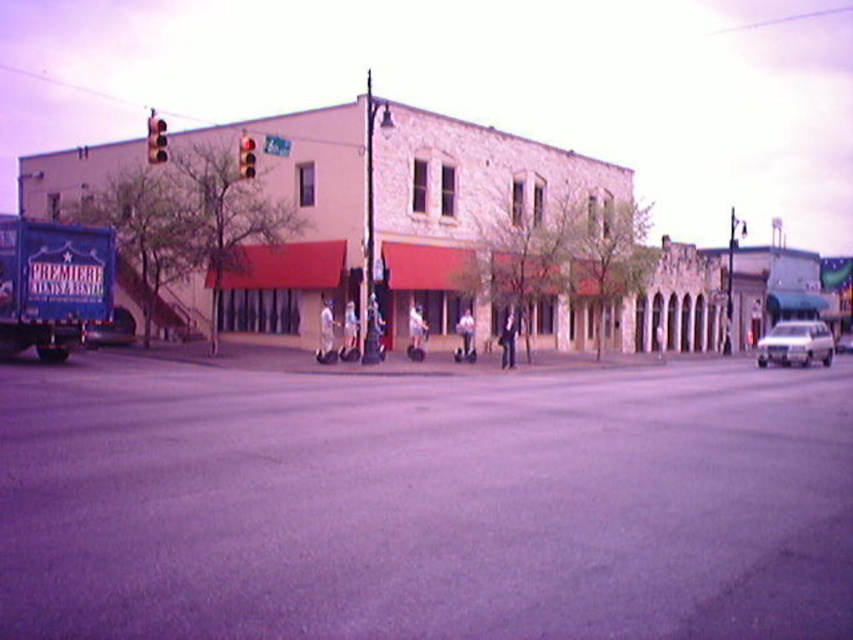
Question: Can you confirm if dark asphalt road at center is positioned above metallic traffic light at upper left?

Choices:
 (A) no
 (B) yes

Answer: (A)

Question: Which object is positioned closest to the silver metallic sedan at right?

Choices:
 (A) red glass traffic light at upper center
 (B) metallic traffic light at upper left

Answer: (A)

Question: Does dark asphalt road at center have a greater width compared to red glass traffic light at upper center?

Choices:
 (A) yes
 (B) no

Answer: (A)

Question: Does metallic traffic light at upper left have a greater width compared to red glass traffic light at upper center?

Choices:
 (A) yes
 (B) no

Answer: (A)

Question: Which of the following is the closest to the observer?

Choices:
 (A) 163,616
 (B) 248,147
 (C) 158,150
 (D) 792,339

Answer: (A)

Question: Which object is farther from the camera taking this photo?

Choices:
 (A) metallic traffic light at upper left
 (B) dark asphalt road at center
 (C) silver metallic sedan at right

Answer: (C)